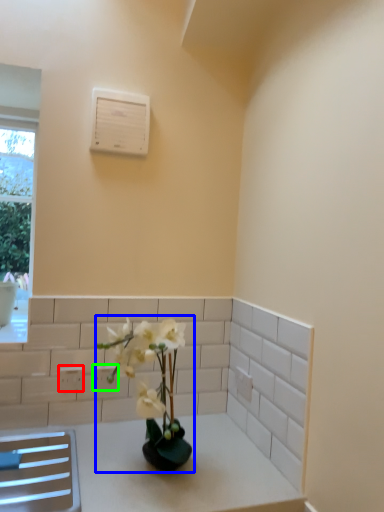
Question: Based on their relative distances, which object is farther from electric outlet (highlighted by a red box)? Choose from houseplant (highlighted by a blue box) and electric outlet (highlighted by a green box).

Choices:
 (A) houseplant
 (B) electric outlet

Answer: (A)